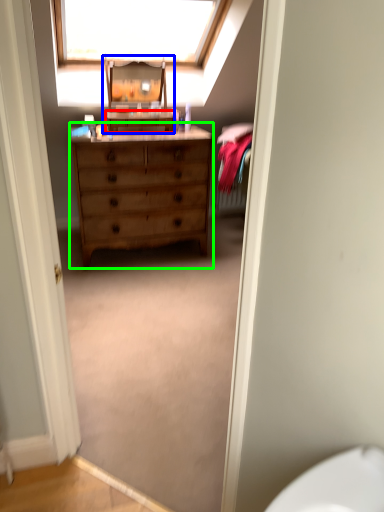
Question: Based on their relative distances, which object is farther from cabinetry (highlighted by a red box)? Choose from changing table (highlighted by a blue box) and chest of drawers (highlighted by a green box).

Choices:
 (A) changing table
 (B) chest of drawers

Answer: (B)